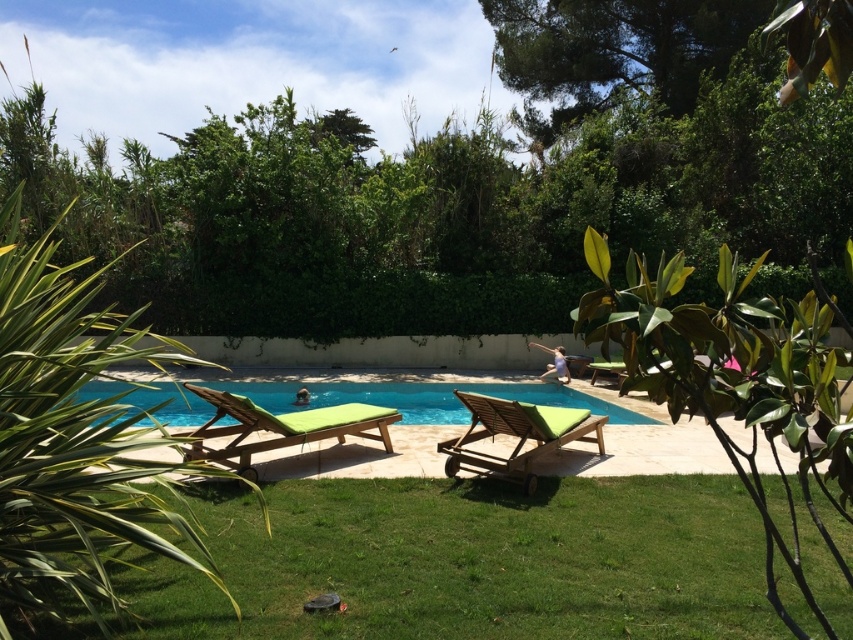
You are standing at the edge of the pool and want to place a small potted plant between the green grass at lower center and the green fabric lounge chair at lower center. Based on their positions, where should you place the plant?

The green grass at lower center is to the right of the green fabric lounge chair at lower center, so you should place the plant between them by positioning it to the right of the green fabric lounge chair at lower center and to the left of the green grass at lower center.

You are standing at the point marked as point (469, 561) in the image. What surface are you currently standing on?

The point (469, 561) is on green grass at lower center, so you are standing on green grass.